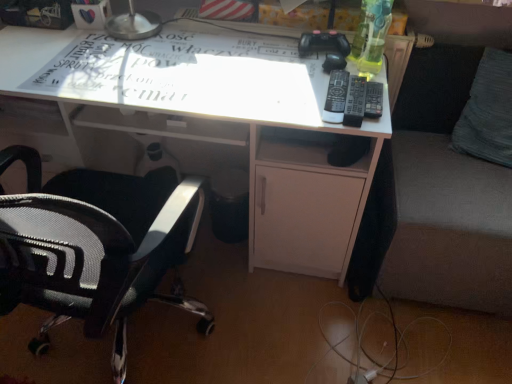
Question: From the image's perspective, is white glossy desk at center above or below black mesh office chair at left?

Choices:
 (A) above
 (B) below

Answer: (A)

Question: From a real-world perspective, is white glossy desk at center physically located above or below black mesh office chair at left?

Choices:
 (A) below
 (B) above

Answer: (A)

Question: Which object is positioned closest to the black mesh office chair at left?

Choices:
 (A) dark gray fabric couch at right
 (B) white matte wire at lower center
 (C) black plastic remote at upper right, the third remote from the right
 (D) white paper at center
 (E) black plastic remote at right, placed as the 1th remote when sorted from right to left

Answer: (D)

Question: Which object is the closest to the dark gray fabric couch at right?

Choices:
 (A) white paper at center
 (B) black plastic remote at right, the second remote when ordered from right to left
 (C) black mesh office chair at left
 (D) white glossy desk at center
 (E) black plastic remote at right, the 3th remote when ordered from left to right

Answer: (D)